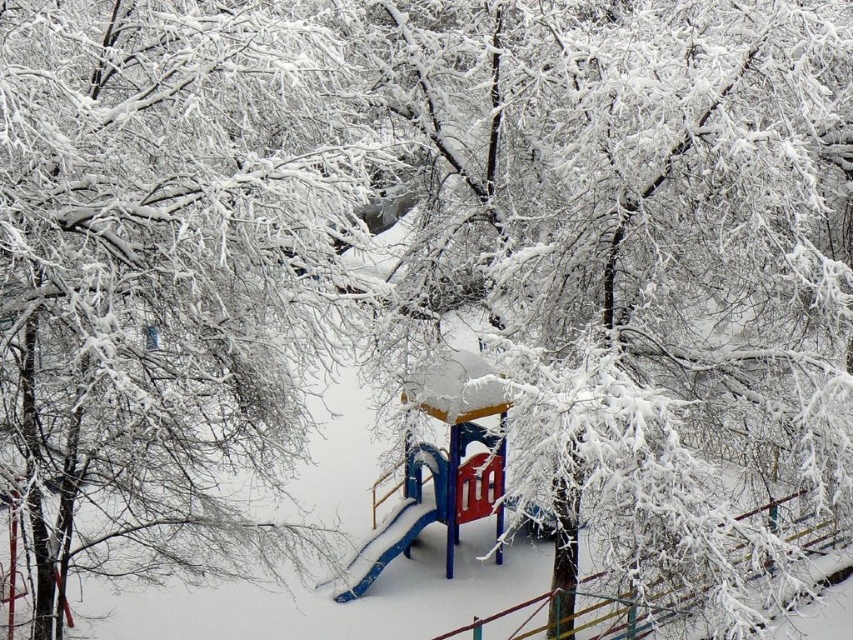
Is point (50, 612) positioned behind point (434, 509)?

No, (50, 612) is in front of (434, 509).

From the picture: Can you confirm if snow-covered branches at center is taller than blue plastic slide at center?

Incorrect, snow-covered branches at center's height is not larger of blue plastic slide at center's.

Between point (259, 180) and point (439, 515), which one is positioned in front?

Point (259, 180) is more forward.

Identify the location of snow-covered branches at center. The image size is (853, 640). (164, 273).